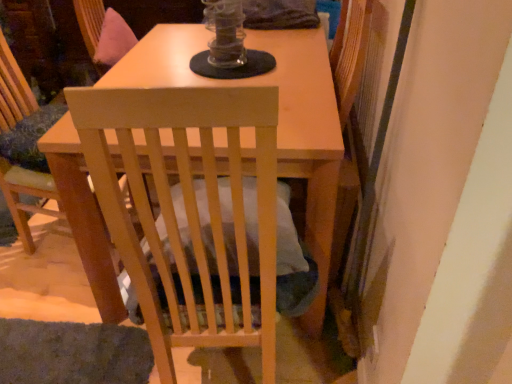
Question: From a real-world perspective, is wooden swivel chair at upper center under light wood chair at center, positioned as the second chair in left-to-right order?

Choices:
 (A) no
 (B) yes

Answer: (A)

Question: From a real-world perspective, is wooden swivel chair at upper center physically above light wood chair at center, positioned as the second chair in left-to-right order?

Choices:
 (A) yes
 (B) no

Answer: (A)

Question: Is wooden swivel chair at upper center oriented away from light wood chair at center, positioned as the second chair in left-to-right order?

Choices:
 (A) no
 (B) yes

Answer: (A)

Question: Is the position of wooden swivel chair at upper center more distant than that of light wood chair at center, positioned as the second chair in left-to-right order?

Choices:
 (A) no
 (B) yes

Answer: (B)

Question: Does wooden swivel chair at upper center have a greater width compared to light wood chair at center, positioned as the second chair in left-to-right order?

Choices:
 (A) yes
 (B) no

Answer: (B)

Question: From a real-world perspective, is wooden swivel chair at upper center positioned above or below light wood chair at center, the 1th chair when ordered from right to left?

Choices:
 (A) above
 (B) below

Answer: (A)

Question: Based on their positions, is wooden swivel chair at upper center located to the left or right of light wood chair at center, positioned as the second chair in left-to-right order?

Choices:
 (A) right
 (B) left

Answer: (B)

Question: Is wooden swivel chair at upper center spatially inside light wood chair at center, the 1th chair when ordered from right to left, or outside of it?

Choices:
 (A) outside
 (B) inside

Answer: (A)

Question: Is wooden swivel chair at upper center taller or shorter than light wood chair at center, the 1th chair when ordered from right to left?

Choices:
 (A) short
 (B) tall

Answer: (A)

Question: From the image's perspective, relative to light wood chair at center, the 1th chair when ordered from right to left, is light wood chair at center, the 1th chair from the left, above or below?

Choices:
 (A) below
 (B) above

Answer: (B)

Question: Considering the positions of light wood chair at center, the 1th chair from the left, and light wood chair at center, the 1th chair when ordered from right to left, in the image, is light wood chair at center, the 1th chair from the left, bigger or smaller than light wood chair at center, the 1th chair when ordered from right to left,?

Choices:
 (A) small
 (B) big

Answer: (A)

Question: In terms of width, does light wood chair at center, the 1th chair from the left, look wider or thinner when compared to light wood chair at center, positioned as the second chair in left-to-right order?

Choices:
 (A) wide
 (B) thin

Answer: (B)

Question: Visually, is light wood chair at center, placed as the 2th chair when sorted from right to left, positioned to the left or to the right of light wood chair at center, the 1th chair when ordered from right to left?

Choices:
 (A) left
 (B) right

Answer: (A)

Question: In the image, is light wood chair at center, the 1th chair from the left, positioned in front of or behind wooden swivel chair at upper center?

Choices:
 (A) front
 (B) behind

Answer: (A)

Question: From a real-world perspective, is light wood chair at center, the 1th chair from the left, above or below wooden swivel chair at upper center?

Choices:
 (A) above
 (B) below

Answer: (B)